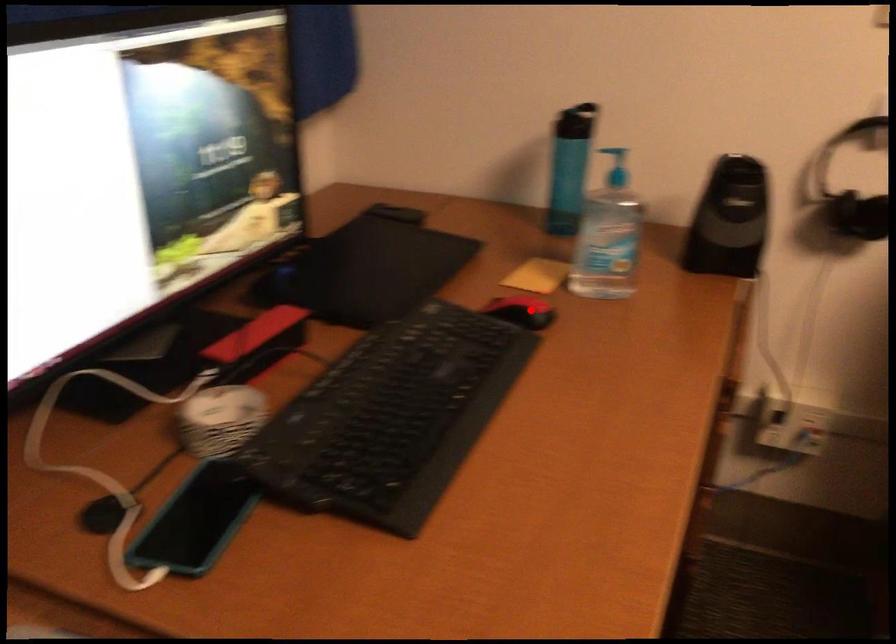
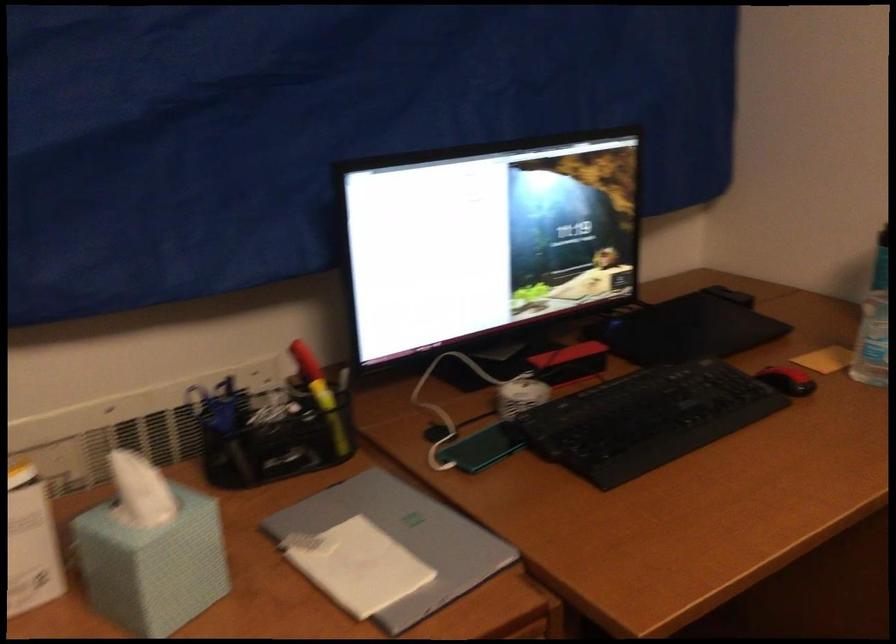
In the second image, find the point that corresponds to the highlighted location in the first image.

(787, 380)